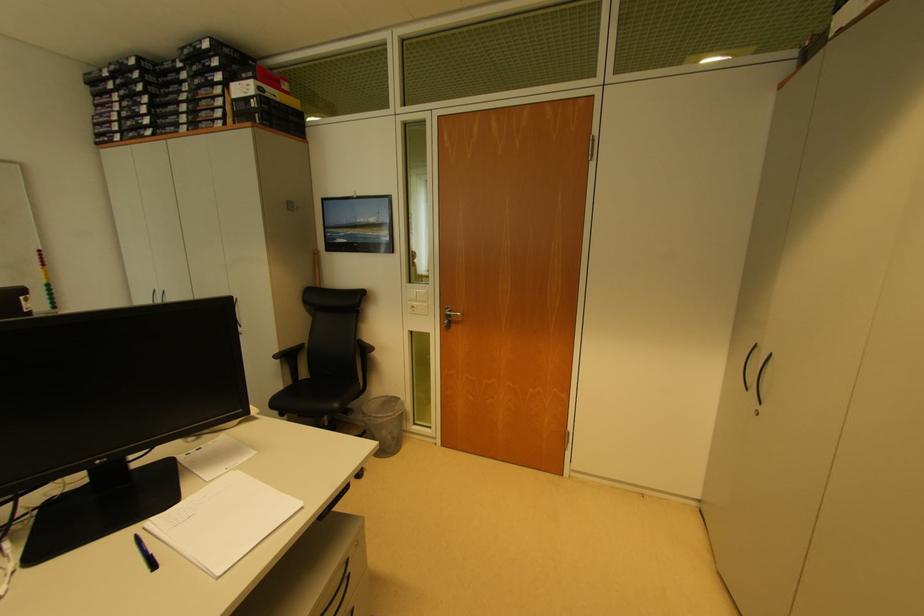
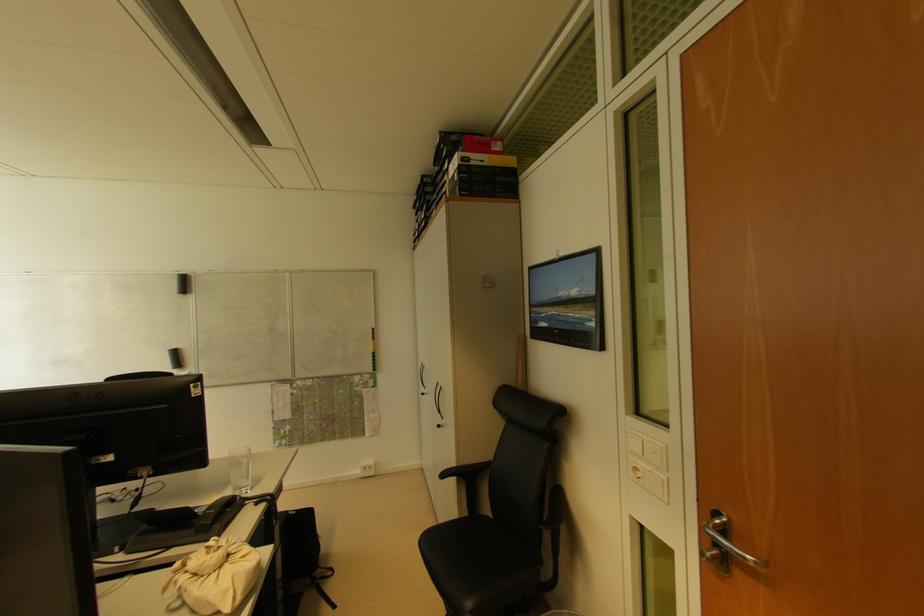
In the second image, find the point that corresponds to point (283, 355) in the first image.

(458, 469)